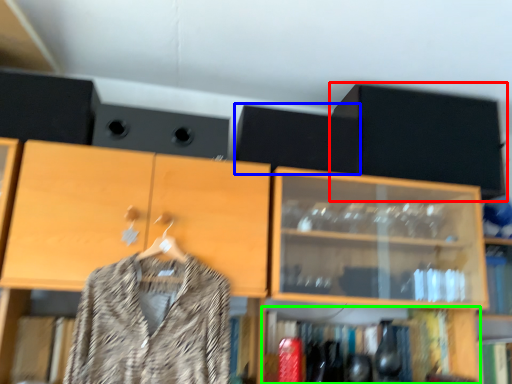
Question: Based on their relative distances, which object is farther from cabinetry (highlighted by a red box)? Choose from speaker (highlighted by a blue box) and shelf (highlighted by a green box).

Choices:
 (A) speaker
 (B) shelf

Answer: (B)